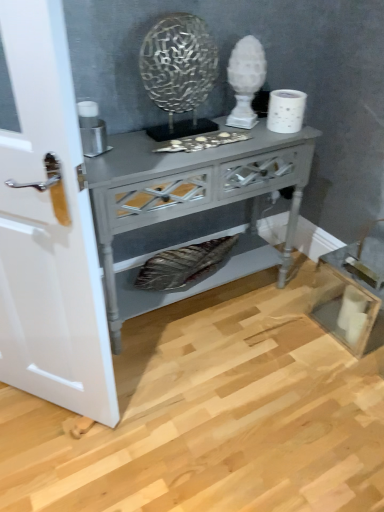
Question: Can you confirm if metallic silver candle holder at left is wider than matte gray wooden nightstand at center?

Choices:
 (A) no
 (B) yes

Answer: (A)

Question: Considering the relative positions of metallic silver candle holder at left and matte gray wooden nightstand at center in the image provided, is metallic silver candle holder at left in front of matte gray wooden nightstand at center?

Choices:
 (A) yes
 (B) no

Answer: (B)

Question: Does metallic silver candle holder at left turn towards matte gray wooden nightstand at center?

Choices:
 (A) yes
 (B) no

Answer: (B)

Question: From a real-world perspective, is metallic silver candle holder at left under matte gray wooden nightstand at center?

Choices:
 (A) yes
 (B) no

Answer: (B)

Question: From a real-world perspective, is metallic silver candle holder at left on matte gray wooden nightstand at center?

Choices:
 (A) no
 (B) yes

Answer: (B)

Question: Could matte gray wooden nightstand at center be considered to be inside metallic silver candle holder at left?

Choices:
 (A) yes
 (B) no

Answer: (B)

Question: Is metallic silver candle holder at left wider than white glossy door at left?

Choices:
 (A) yes
 (B) no

Answer: (A)

Question: Is there a large distance between metallic silver candle holder at left and white glossy door at left?

Choices:
 (A) yes
 (B) no

Answer: (B)

Question: Could white glossy door at left be considered to be inside metallic silver candle holder at left?

Choices:
 (A) yes
 (B) no

Answer: (B)

Question: Does metallic silver candle holder at left have a smaller size compared to white glossy door at left?

Choices:
 (A) no
 (B) yes

Answer: (B)

Question: From a real-world perspective, is metallic silver candle holder at left positioned under white glossy door at left based on gravity?

Choices:
 (A) no
 (B) yes

Answer: (A)

Question: From a real-world perspective, is metallic silver candle holder at left positioned over white glossy door at left based on gravity?

Choices:
 (A) yes
 (B) no

Answer: (A)

Question: Considering the relative sizes of white textured toilet paper at upper right and matte gray wooden nightstand at center in the image provided, is white textured toilet paper at upper right wider than matte gray wooden nightstand at center?

Choices:
 (A) no
 (B) yes

Answer: (A)